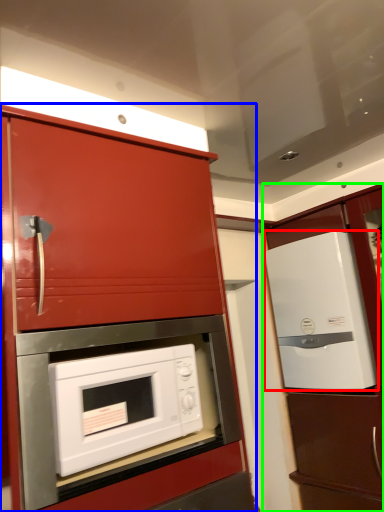
Question: Based on their relative distances, which object is nearer to refrigerator (highlighted by a red box)? Choose from cabinetry (highlighted by a blue box) and cabinetry (highlighted by a green box).

Choices:
 (A) cabinetry
 (B) cabinetry

Answer: (B)